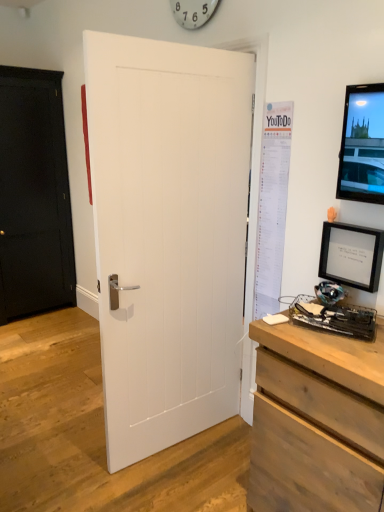
Question: Is black matte picture frame at right to the right of white matte notepad at center from the viewer's perspective?

Choices:
 (A) no
 (B) yes

Answer: (B)

Question: Is black matte picture frame at right placed right next to white matte notepad at center?

Choices:
 (A) yes
 (B) no

Answer: (B)

Question: Is black matte picture frame at right behind white matte notepad at center?

Choices:
 (A) no
 (B) yes

Answer: (B)

Question: Is the depth of black matte picture frame at right less than that of white matte notepad at center?

Choices:
 (A) yes
 (B) no

Answer: (B)

Question: Is black matte picture frame at right oriented towards white matte notepad at center?

Choices:
 (A) yes
 (B) no

Answer: (A)

Question: From a real-world perspective, is black matte picture frame at right on white matte notepad at center?

Choices:
 (A) yes
 (B) no

Answer: (A)

Question: From a real-world perspective, is metallic black desktop computer at lower right positioned over white paper poster at right based on gravity?

Choices:
 (A) no
 (B) yes

Answer: (A)

Question: Does metallic black desktop computer at lower right come behind white paper poster at right?

Choices:
 (A) yes
 (B) no

Answer: (B)

Question: Could you tell me if metallic black desktop computer at lower right is turned towards white paper poster at right?

Choices:
 (A) no
 (B) yes

Answer: (A)

Question: Is metallic black desktop computer at lower right far away from white paper poster at right?

Choices:
 (A) yes
 (B) no

Answer: (B)

Question: From the image's perspective, is metallic black desktop computer at lower right on white paper poster at right?

Choices:
 (A) no
 (B) yes

Answer: (A)

Question: Is metallic black desktop computer at lower right surrounding white paper poster at right?

Choices:
 (A) yes
 (B) no

Answer: (B)

Question: Does white plastic clock at upper center have a smaller size compared to black matte door at left, the first door when ordered from back to front?

Choices:
 (A) yes
 (B) no

Answer: (A)